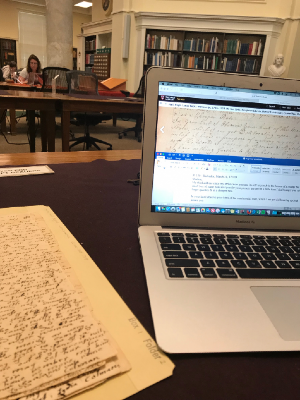
Locate an element on the screen. laptop is located at coordinates (213, 322).